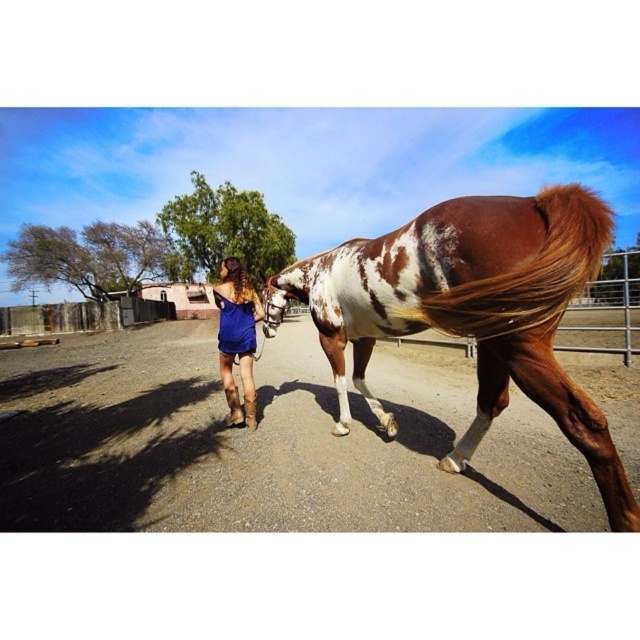
Question: Can you confirm if brown gravel dirt track at center is positioned above blue satin dress at center?

Choices:
 (A) yes
 (B) no

Answer: (B)

Question: Which of the following is the farthest from the observer?

Choices:
 (A) brown silky tail at right
 (B) brown speckled horse at center

Answer: (B)

Question: Which of the following is the closest to the observer?

Choices:
 (A) (609, 234)
 (B) (536, 380)
 (C) (230, 355)
 (D) (68, 444)

Answer: (A)

Question: Is brown gravel dirt track at center to the left of brown silky tail at right from the viewer's perspective?

Choices:
 (A) yes
 (B) no

Answer: (A)

Question: Which of these objects is positioned closest to the blue satin dress at center?

Choices:
 (A) brown silky tail at right
 (B) brown gravel dirt track at center
 (C) brown speckled horse at center

Answer: (C)

Question: Is brown gravel dirt track at center further to camera compared to brown speckled horse at center?

Choices:
 (A) yes
 (B) no

Answer: (A)